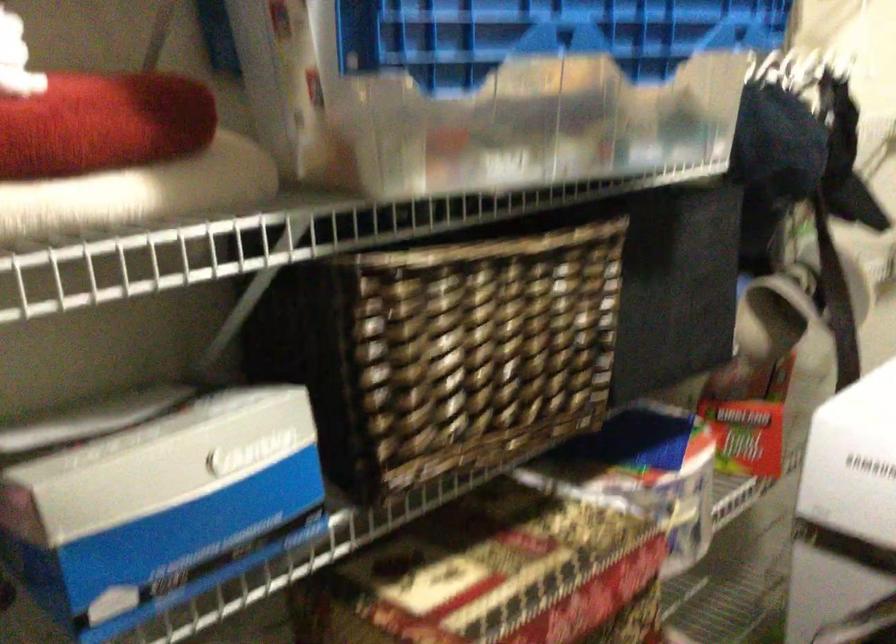
Where would you pull the brown wicker basket? Please return your answer as a coordinate pair (x, y).

(453, 344)